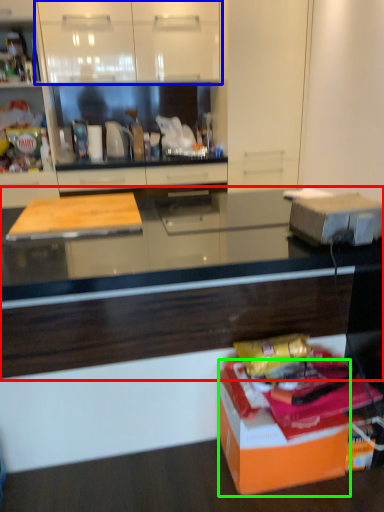
Question: Estimate the real-world distances between objects in this image. Which object is closer to countertop (highlighted by a red box), cabinetry (highlighted by a blue box) or cardboard box (highlighted by a green box)?

Choices:
 (A) cabinetry
 (B) cardboard box

Answer: (B)